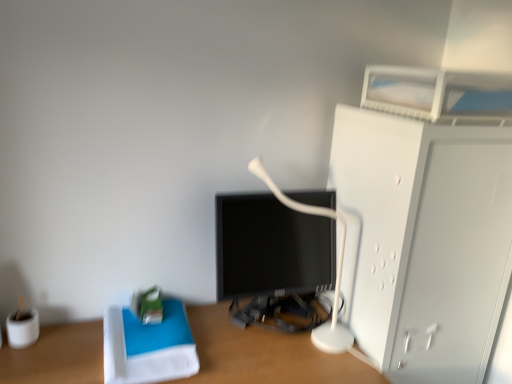
Question: Is white plastic table lamp at center closer to the viewer compared to wooden desk at center?

Choices:
 (A) yes
 (B) no

Answer: (B)

Question: Considering the relative sizes of white plastic table lamp at center and wooden desk at center in the image provided, is white plastic table lamp at center wider than wooden desk at center?

Choices:
 (A) no
 (B) yes

Answer: (A)

Question: Is white plastic table lamp at center thinner than wooden desk at center?

Choices:
 (A) yes
 (B) no

Answer: (A)

Question: Can you confirm if white plastic table lamp at center is taller than wooden desk at center?

Choices:
 (A) no
 (B) yes

Answer: (B)

Question: Is wooden desk at center located within white plastic table lamp at center?

Choices:
 (A) no
 (B) yes

Answer: (A)

Question: Does white plastic table lamp at center appear on the left side of wooden desk at center?

Choices:
 (A) no
 (B) yes

Answer: (A)

Question: Is white plastic table lamp at center positioned in front of white matte cabinet at right?

Choices:
 (A) yes
 (B) no

Answer: (B)

Question: From the image's perspective, is white plastic table lamp at center beneath white matte cabinet at right?

Choices:
 (A) no
 (B) yes

Answer: (A)

Question: Does white plastic table lamp at center turn towards white matte cabinet at right?

Choices:
 (A) yes
 (B) no

Answer: (B)

Question: Is white matte cabinet at right completely or partially inside white plastic table lamp at center?

Choices:
 (A) yes
 (B) no

Answer: (B)

Question: Does white plastic table lamp at center have a lesser width compared to white matte cabinet at right?

Choices:
 (A) no
 (B) yes

Answer: (B)

Question: From a real-world perspective, is white plastic table lamp at center under white matte cabinet at right?

Choices:
 (A) no
 (B) yes

Answer: (A)

Question: Can you confirm if white matte cabinet at right is positioned to the right of wooden desk at center?

Choices:
 (A) yes
 (B) no

Answer: (A)